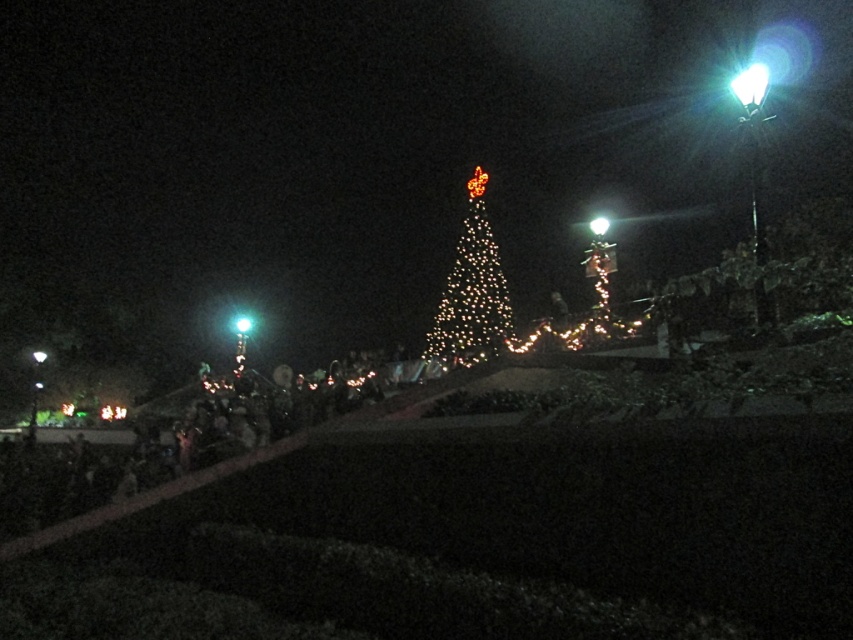
You are standing at the entrance of the festive area and see two points marked in the image. The first point is at coordinate point[474,356] and the second point is at coordinate point[759,83]. Which point is closer to you?

Point[759,83] is closer to you because it is less further to the camera than point[474,356].